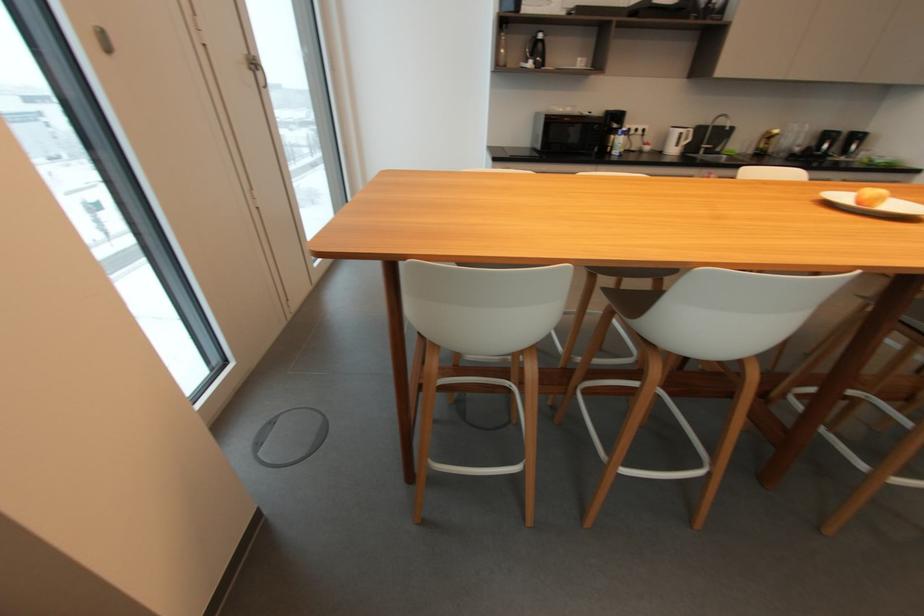
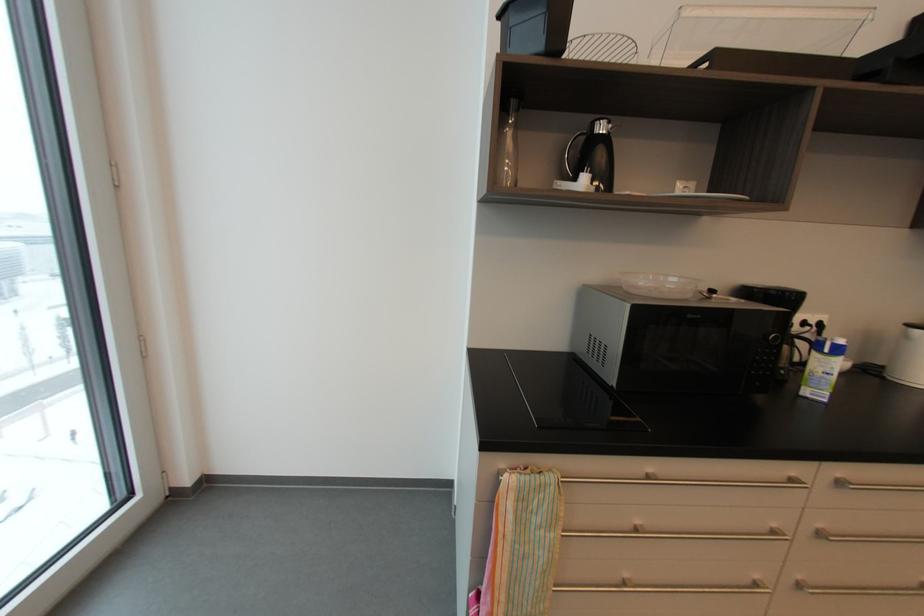
Question: What movement of the cameraman would produce the second image?

Choices:
 (A) Left
 (B) Right
 (C) Forward
 (D) Backward

Answer: (C)